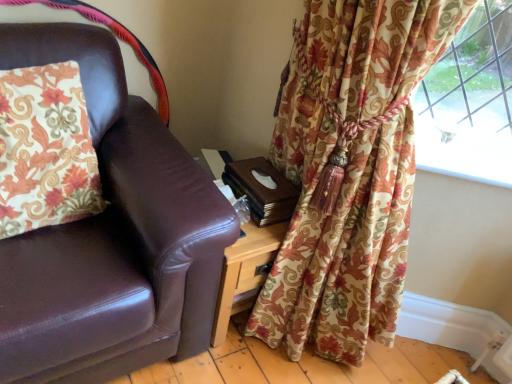
Question: Can you confirm if floral fabric pillow at left is positioned to the right of floral fabric curtain at right?

Choices:
 (A) no
 (B) yes

Answer: (A)

Question: Does floral fabric pillow at left come behind floral fabric curtain at right?

Choices:
 (A) yes
 (B) no

Answer: (A)

Question: Is floral fabric pillow at left facing towards floral fabric curtain at right?

Choices:
 (A) yes
 (B) no

Answer: (B)

Question: Is floral fabric pillow at left at the left side of floral fabric curtain at right?

Choices:
 (A) no
 (B) yes

Answer: (B)

Question: Is floral fabric pillow at left shorter than floral fabric curtain at right?

Choices:
 (A) yes
 (B) no

Answer: (A)

Question: Is floral fabric pillow at left positioned with its back to floral fabric curtain at right?

Choices:
 (A) yes
 (B) no

Answer: (B)

Question: Can you confirm if floral fabric curtain at right is shorter than floral fabric pillow at left?

Choices:
 (A) no
 (B) yes

Answer: (A)

Question: Considering the relative positions of floral fabric curtain at right and floral fabric pillow at left in the image provided, is floral fabric curtain at right to the right of floral fabric pillow at left from the viewer's perspective?

Choices:
 (A) no
 (B) yes

Answer: (B)

Question: Is floral fabric curtain at right to the left of floral fabric pillow at left from the viewer's perspective?

Choices:
 (A) no
 (B) yes

Answer: (A)

Question: From a real-world perspective, is floral fabric curtain at right physically above floral fabric pillow at left?

Choices:
 (A) no
 (B) yes

Answer: (A)

Question: Does floral fabric curtain at right have a smaller size compared to floral fabric pillow at left?

Choices:
 (A) yes
 (B) no

Answer: (B)

Question: Does floral fabric curtain at right lie behind floral fabric pillow at left?

Choices:
 (A) no
 (B) yes

Answer: (A)

Question: Considering their positions, is floral fabric pillow at left located in front of or behind floral fabric curtain at right?

Choices:
 (A) behind
 (B) front

Answer: (A)